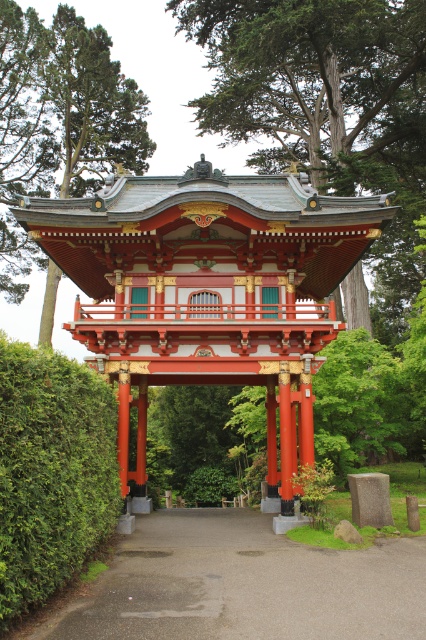
Question: Based on their relative distances, which object is nearer to the green textured tree at upper center?

Choices:
 (A) smooth asphalt path at center
 (B) green leafy hedge at left
 (C) green textured tree at center
 (D) shiny lacquered wood pagoda at center

Answer: (C)

Question: In this image, where is shiny lacquered wood pagoda at center located relative to green leafy hedge at left?

Choices:
 (A) right
 (B) left

Answer: (A)

Question: Can you confirm if smooth asphalt path at center is wider than green textured tree at upper center?

Choices:
 (A) no
 (B) yes

Answer: (A)

Question: Which point appears closest to the camera in this image?

Choices:
 (A) (198, 348)
 (B) (68, 468)
 (C) (204, 524)
 (D) (256, 26)

Answer: (B)

Question: Can you confirm if shiny lacquered wood pagoda at center is positioned above green leafy hedge at left?

Choices:
 (A) no
 (B) yes

Answer: (B)

Question: Among these points, which one is nearest to the camera?

Choices:
 (A) (28, 161)
 (B) (178, 26)

Answer: (A)